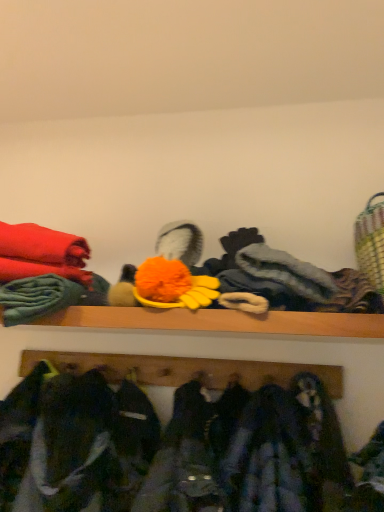
Question: Could you tell me if wooden coat rack at lower center is facing dark blue fabric at lower center?

Choices:
 (A) yes
 (B) no

Answer: (A)

Question: Considering the relative sizes of wooden coat rack at lower center and dark blue fabric at lower center in the image provided, is wooden coat rack at lower center wider than dark blue fabric at lower center?

Choices:
 (A) no
 (B) yes

Answer: (A)

Question: Can you confirm if wooden coat rack at lower center is smaller than dark blue fabric at lower center?

Choices:
 (A) yes
 (B) no

Answer: (A)

Question: Is the depth of wooden coat rack at lower center greater than that of dark blue fabric at lower center?

Choices:
 (A) yes
 (B) no

Answer: (A)

Question: Can dark blue fabric at lower center be found inside wooden coat rack at lower center?

Choices:
 (A) yes
 (B) no

Answer: (B)

Question: Is wooden coat rack at lower center outside of dark blue fabric at lower center?

Choices:
 (A) yes
 (B) no

Answer: (A)

Question: Is wooden coat rack at lower center a part of dark blue fabric at lower center?

Choices:
 (A) yes
 (B) no

Answer: (B)

Question: From the image's perspective, is dark blue fabric at lower center under wooden coat rack at lower center?

Choices:
 (A) yes
 (B) no

Answer: (A)

Question: Is dark blue fabric at lower center placed right next to wooden coat rack at lower center?

Choices:
 (A) yes
 (B) no

Answer: (B)

Question: Does dark blue fabric at lower center have a greater width compared to wooden coat rack at lower center?

Choices:
 (A) yes
 (B) no

Answer: (A)

Question: Is there a large distance between dark blue fabric at lower center and wooden coat rack at lower center?

Choices:
 (A) no
 (B) yes

Answer: (A)

Question: Is dark blue fabric at lower center bigger than wooden coat rack at lower center?

Choices:
 (A) yes
 (B) no

Answer: (A)

Question: Based on their positions, is wooden coat rack at lower center located to the left or right of dark blue fabric at lower center?

Choices:
 (A) left
 (B) right

Answer: (A)